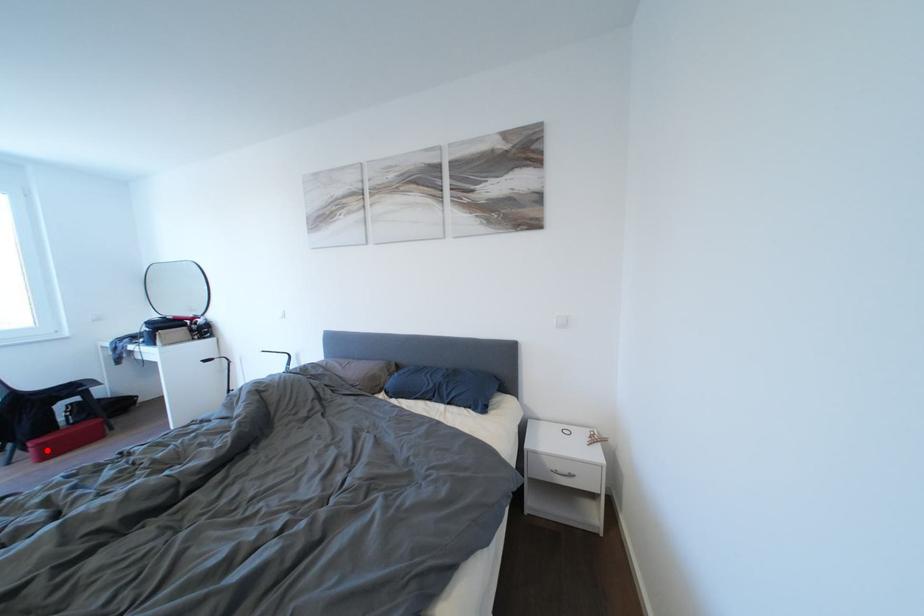
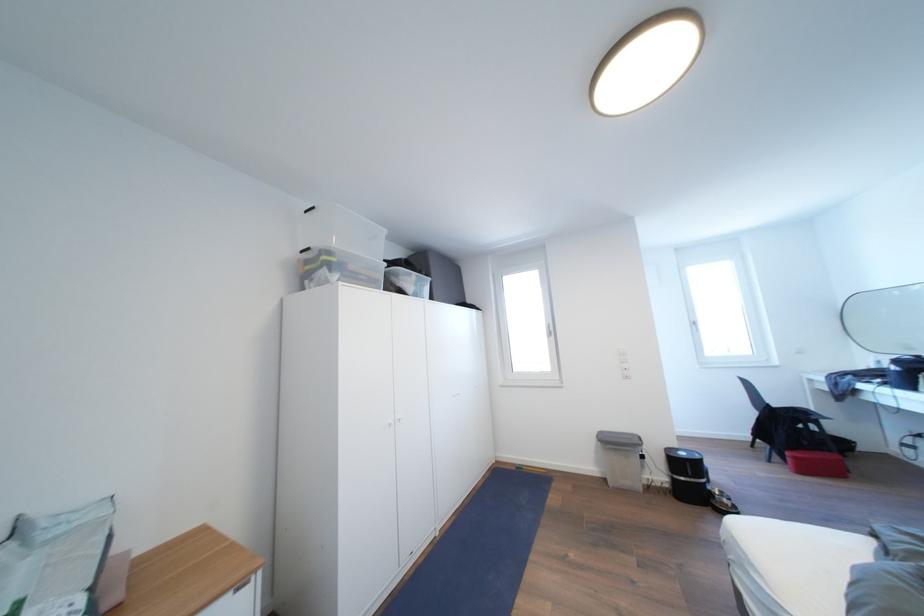
The point at the highlighted location is marked in the first image. Where is the corresponding point in the second image?

(803, 463)